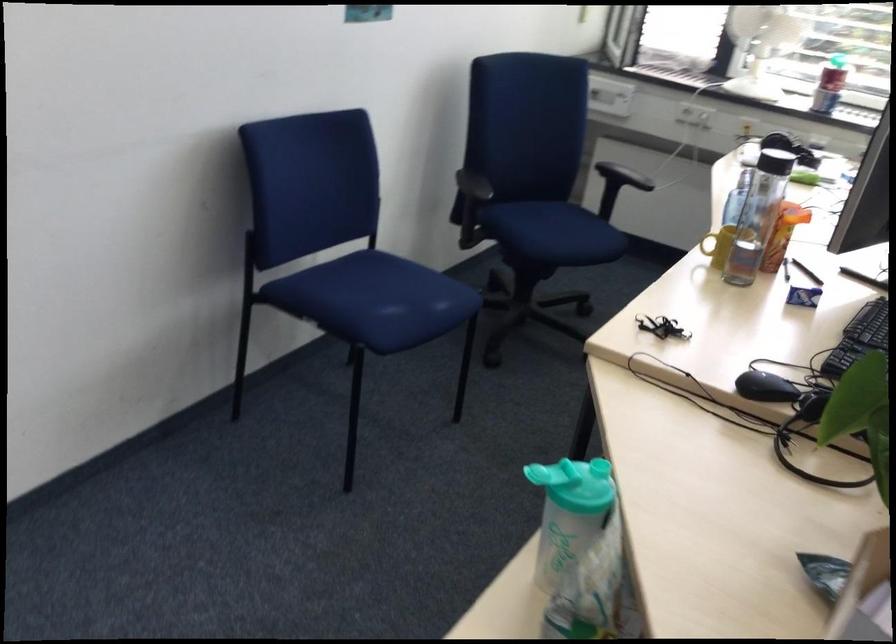
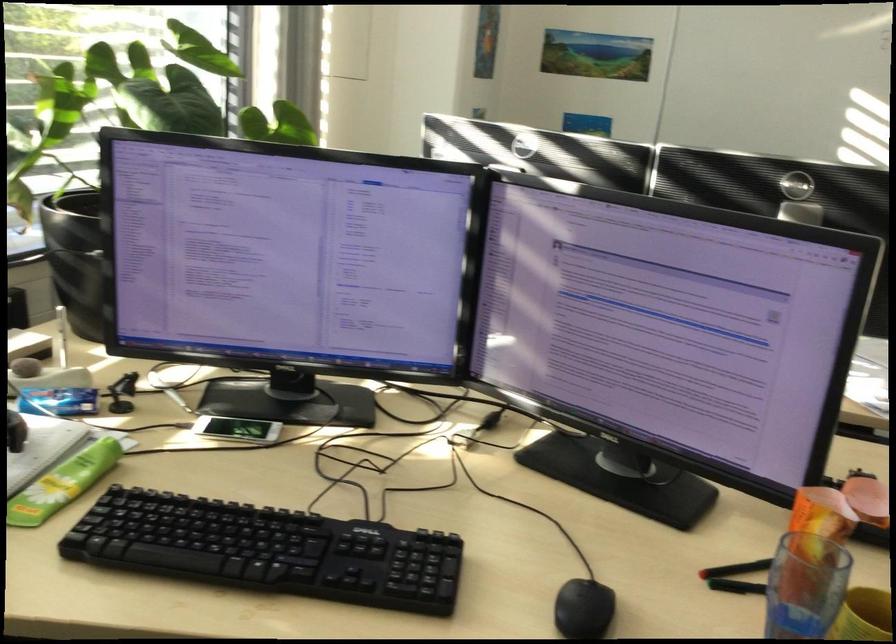
Locate, in the second image, the point that corresponds to pixel 769 242 in the first image.

(805, 585)